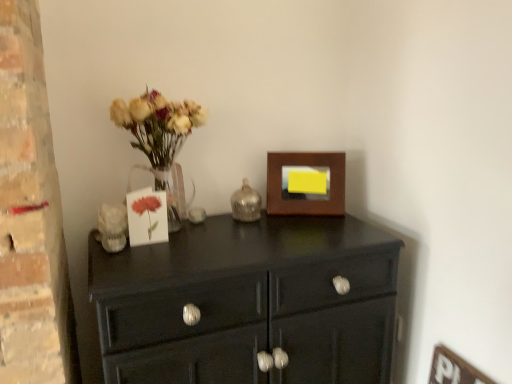
At what (x,y) coordinates should I click in order to perform the action: click on vacant area in front of white matte card at center. Please return your answer as a coordinate pair (x, y). This screenshot has width=512, height=384. Looking at the image, I should click on (143, 262).